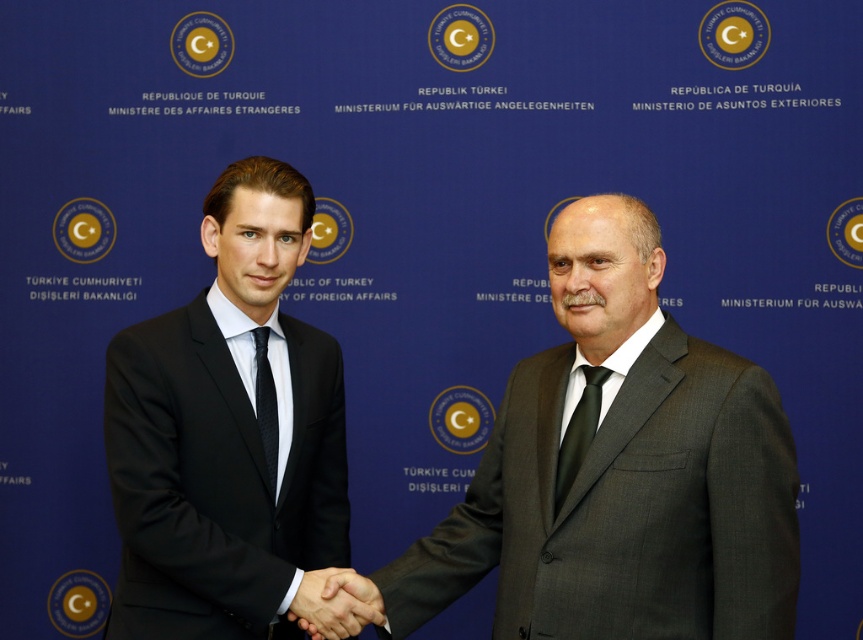
You are attending a formal event and need to position two markers on the backdrop. The first marker must be placed at the location of point (347, 572) and the second at point (603, 372). According to the scene description, which marker will appear closer to the viewer?

Point (603, 372) will appear closer to the viewer because the Objects Description states that point (347, 572) is behind point (603, 372).